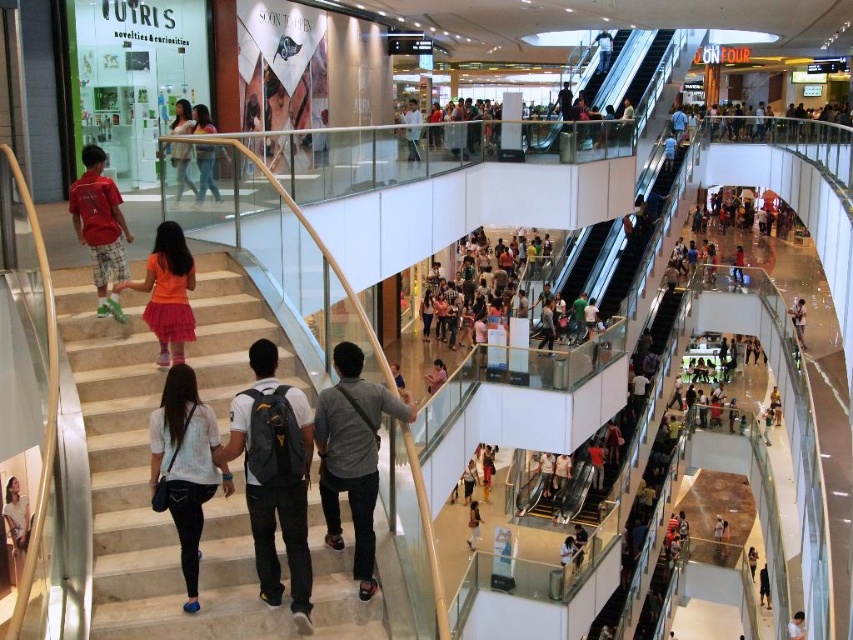
Question: Among these points, which one is farthest from the camera?

Choices:
 (A) (206, 365)
 (B) (187, 124)
 (C) (7, 486)

Answer: (C)

Question: Is matte pink dress at center wider than red cotton shirt at left?

Choices:
 (A) yes
 (B) no

Answer: (A)

Question: Does blue jeans at upper center have a larger size compared to matte black backpack at center?

Choices:
 (A) no
 (B) yes

Answer: (A)

Question: Can you confirm if marble stairs at center is smaller than white matte shirt at center?

Choices:
 (A) no
 (B) yes

Answer: (B)

Question: Among these points, which one is nearest to the camera?

Choices:
 (A) (599, 51)
 (B) (96, 232)
 (C) (178, 248)

Answer: (C)

Question: Which point appears farthest from the camera in this image?

Choices:
 (A) (479, 509)
 (B) (601, 32)
 (C) (192, 372)
 (D) (102, 211)

Answer: (B)